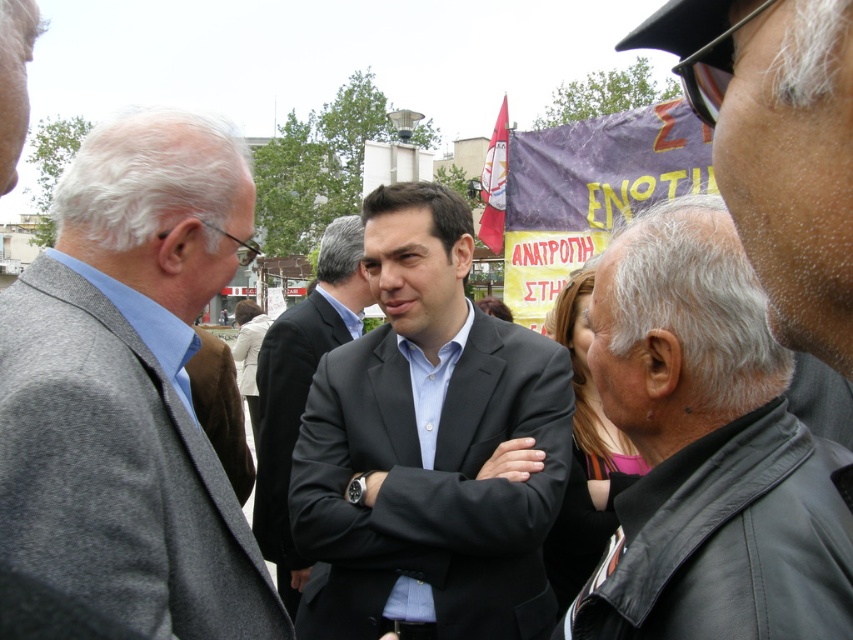
You are a photographer at this event and want to capture a clear photo of the dark gray suit at center without the black leather jacket at right blocking it. What should you do?

Move to the left side so that the black leather jacket at right is no longer in front of the dark gray suit at center.

You are a photographer at a public event. You need to capture a clear photo of both the matte black suit at center and the dark gray suit at center. Since you can only focus on one subject at a time, which suit should you focus on first to ensure the other remains in the background?

The matte black suit at center is closer to the viewer than the dark gray suit at center, so you should focus on the matte black suit at center first. This way, the dark gray suit at center will naturally be in the background and still somewhat in focus.